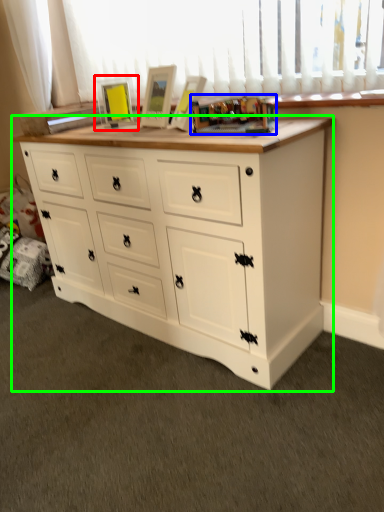
Question: Estimate the real-world distances between objects in this image. Which object is farther from picture frame (highlighted by a red box), toy (highlighted by a blue box) or chest of drawers (highlighted by a green box)?

Choices:
 (A) toy
 (B) chest of drawers

Answer: (B)